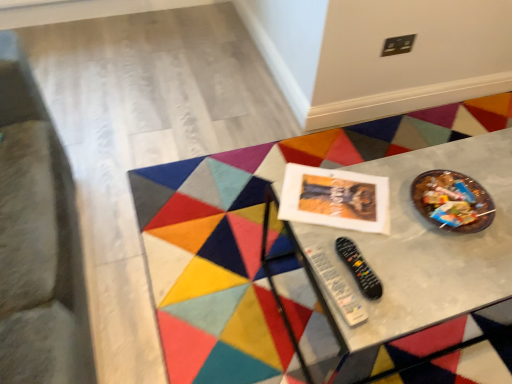
Question: Is point (364, 162) positioned closer to the camera than point (352, 264)?

Choices:
 (A) closer
 (B) farther

Answer: (B)

Question: In terms of size, does metallic gray table at center appear bigger or smaller than black plastic remote at center, placed as the second control when sorted from left to right?

Choices:
 (A) big
 (B) small

Answer: (A)

Question: Which is farther from the black plastic remote at lower center, arranged as the 2th control when viewed from the right?

Choices:
 (A) metallic gray table at center
 (B) black plastic remote at center, placed as the second control when sorted from left to right

Answer: (A)

Question: Considering the real-world distances, which object is farthest from the black plastic remote at center, placed as the second control when sorted from left to right?

Choices:
 (A) black plastic remote at lower center, arranged as the 2th control when viewed from the right
 (B) metallic gray table at center

Answer: (B)